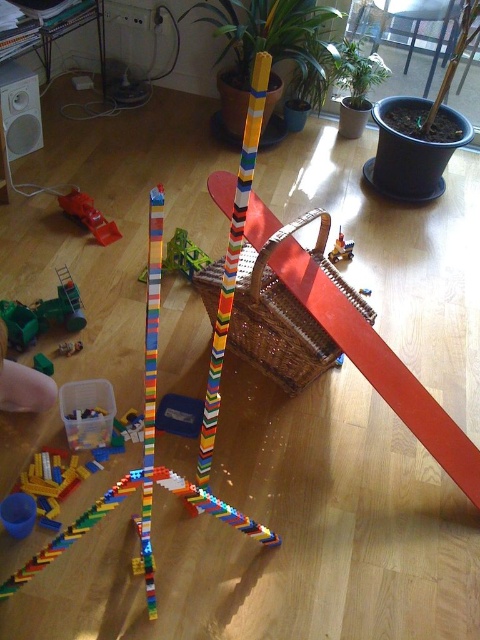
Looking at this image, you are a child who wants to reach the matte plastic toy at center. You are currently standing 3 feet away from it. How many more feet do you need to move forward to grab it?

The matte plastic toy at center is 7.14 feet away from the camera. Since you are already 3 feet away from it, you need to move forward an additional 4.14 feet to reach it.

You are a child trying to place a new LEGO brick on the existing structure. The point where you want to place it is at coordinates point (340, 248). Is this point located on the LEGO structure or somewhere else?

The point (340, 248) is the location of the matte plastic toy, which is separate from the LEGO structure. Therefore, placing the brick there would be outside the LEGO structure.

You are a child who wants to stack the green matte toy car at lower left and the matte plastic toy at center on top of each other. Which one should you place at the bottom to ensure stability?

The green matte toy car at lower left is taller than the matte plastic toy at center, so placing the green matte toy car at lower left at the bottom would provide a stable base for the stack.